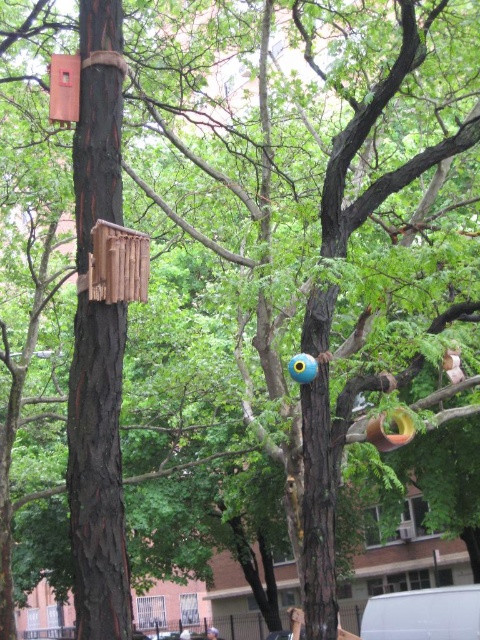
You are a park maintenance worker checking the space between the wooden bird feeder at left and the blue plastic ball at center. Can you fit a 1.2 meter ladder horizontally between them?

The wooden bird feeder at left occupies less space than the blue plastic ball at center, so there is enough space to fit a 1.2 meter ladder horizontally between them.